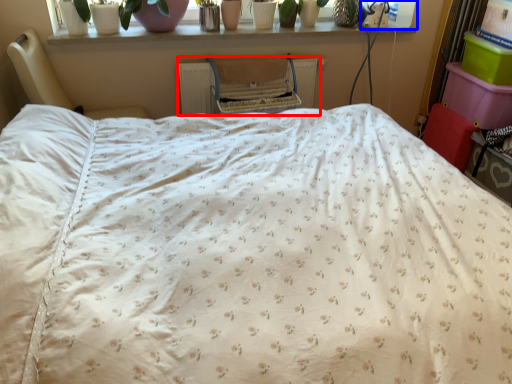
Question: Among these objects, which one is nearest to the camera, radiator (highlighted by a red box) or window screen (highlighted by a blue box)?

Choices:
 (A) radiator
 (B) window screen

Answer: (A)